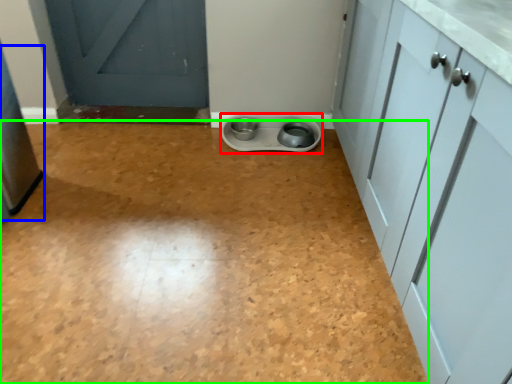
Question: Which object is the closest to the appliance (highlighted by a red box)? Choose among these: appliance (highlighted by a blue box) or plain (highlighted by a green box).

Choices:
 (A) appliance
 (B) plain

Answer: (B)